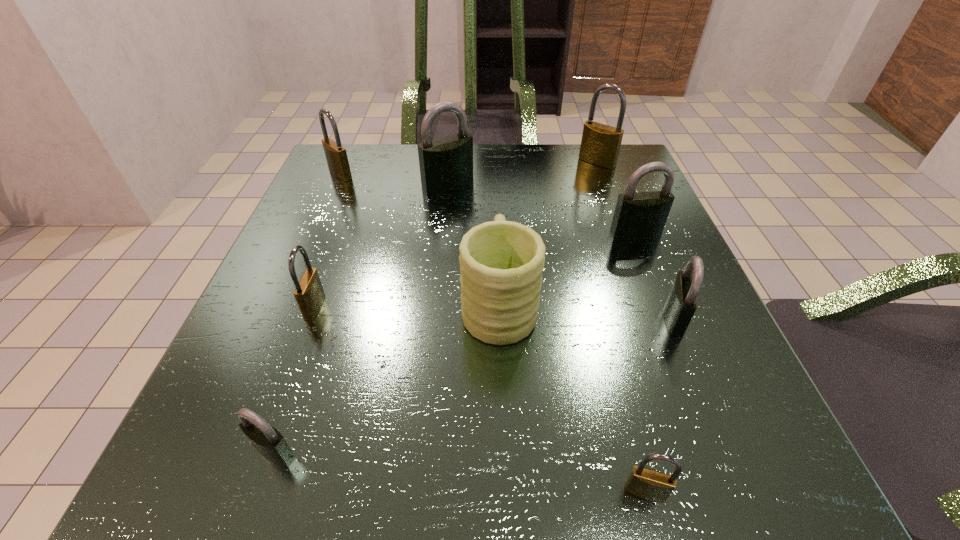
Where is `vacant space situated on the side of the green mug with the handle`? The height and width of the screenshot is (540, 960). vacant space situated on the side of the green mug with the handle is located at coordinates (493, 170).

Locate an element on the screen. This screenshot has width=960, height=540. vacant position located 0.180m on the side of the green mug with the handle is located at coordinates (494, 207).

You are a GUI agent. You are given a task and a screenshot of the screen. Output one action in this format:
    pyautogui.click(x=<x>, y=<y>)
    Task: Click on the vacant space located on the front of the third farthest brass padlock
    This screenshot has width=960, height=540.
    Given the screenshot: What is the action you would take?
    pyautogui.click(x=255, y=471)

What are the coordinates of `vacant space located 0.060m on the front of the second smallest black padlock` in the screenshot? It's located at (697, 373).

Locate an element on the screen. This screenshot has width=960, height=540. vacant region located 0.330m on the right of the smallest black padlock is located at coordinates (570, 451).

Identify the location of vacant space positioned 0.400m on the back of the second brass padlock from right to left. The image size is (960, 540). (584, 254).

What are the coordinates of `object located in the far left corner section of the desktop` in the screenshot? It's located at 336,156.

Find the location of a particular element. object located in the near left corner section of the desktop is located at coordinates (268, 441).

Where is `object at the far right corner`? The width and height of the screenshot is (960, 540). object at the far right corner is located at coordinates click(x=600, y=145).

I want to click on object that is at the near right corner, so click(648, 484).